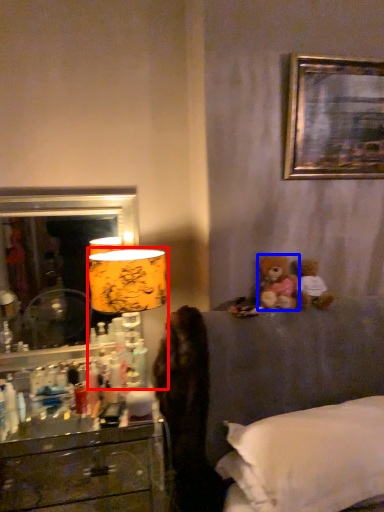
Question: Which of the following is the farthest to the observer, table lamp (highlighted by a red box) or teddy bear (highlighted by a blue box)?

Choices:
 (A) table lamp
 (B) teddy bear

Answer: (B)